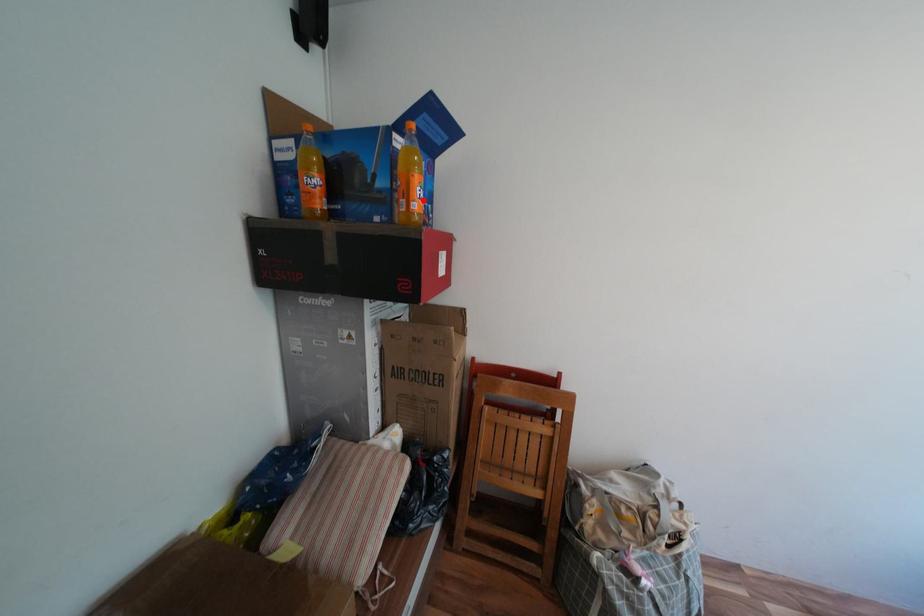
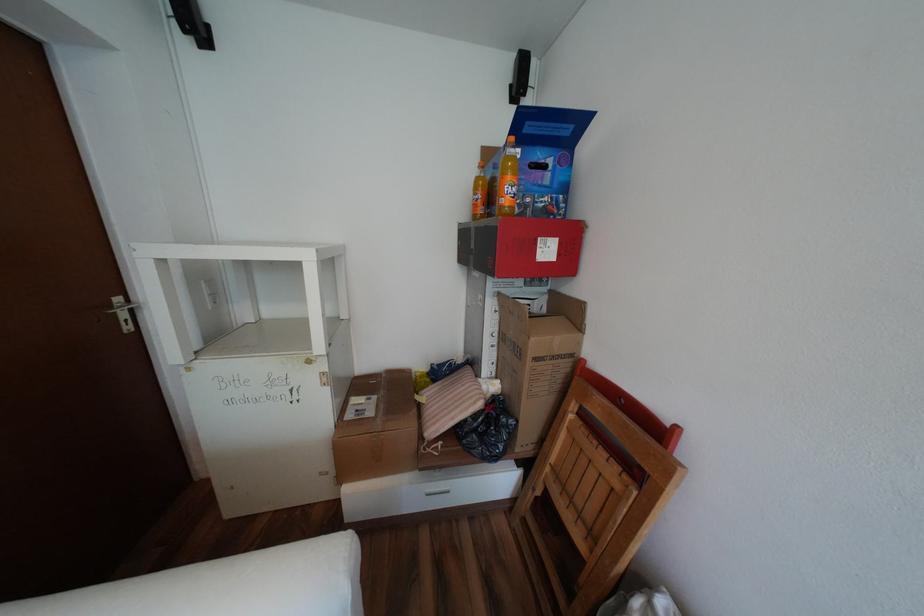
In the second image, find the point that corresponds to the highlighted location in the first image.

(512, 197)